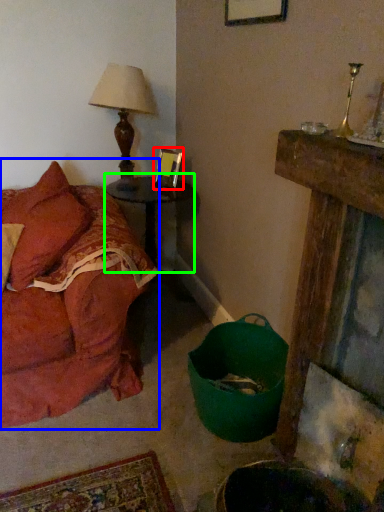
Question: Considering the real-world distances, which object is farthest from picture frame (highlighted by a red box)? studio couch (highlighted by a blue box) or table (highlighted by a green box)?

Choices:
 (A) studio couch
 (B) table

Answer: (A)